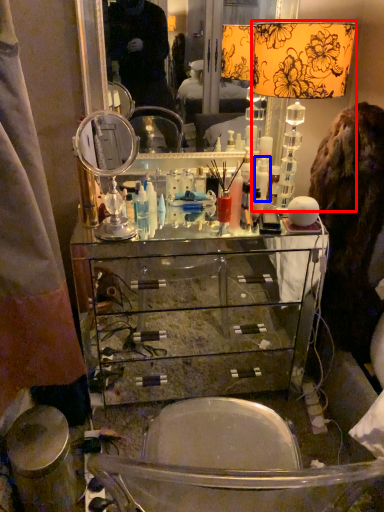
Question: Which point is closer to the camera, table lamp (highlighted by a red box) or toiletry (highlighted by a blue box)?

Choices:
 (A) table lamp
 (B) toiletry

Answer: (A)